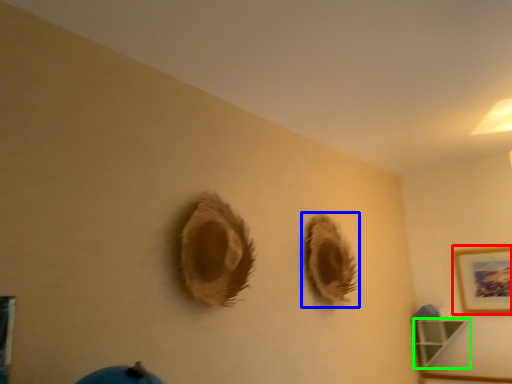
Question: Which object is positioned farthest from picture frame (highlighted by a red box)? Select from hole (highlighted by a blue box) and shelf (highlighted by a green box).

Choices:
 (A) hole
 (B) shelf

Answer: (A)